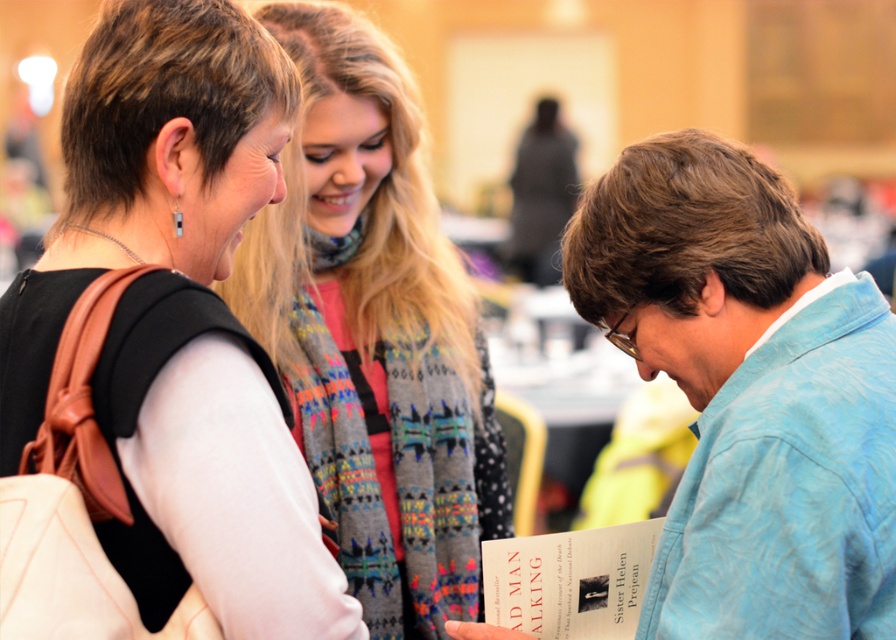
Which is above, matte black top at upper left or white sweater at center?

white sweater at center

I want to click on matte black top at upper left, so click(x=178, y=320).

Is point (135, 342) less distant than point (343, 24)?

Yes, point (135, 342) is in front of point (343, 24).

The height and width of the screenshot is (640, 896). Identify the location of matte black top at upper left. (178, 320).

Does white sweater at center appear on the right side of matte paper book at lower right?

No, white sweater at center is not to the right of matte paper book at lower right.

Which is more to the left, white sweater at center or matte paper book at lower right?

white sweater at center is more to the left.

The image size is (896, 640). I want to click on white sweater at center, so (x=376, y=339).

Which is behind, point (141, 330) or point (591, 529)?

Point (591, 529)

Which is more to the right, matte black top at upper left or matte paper book at lower right?

matte paper book at lower right is more to the right.

Which is behind, point (135, 132) or point (571, 602)?

The point (571, 602) is more distant.

Identify the location of matte black top at upper left. (178, 320).